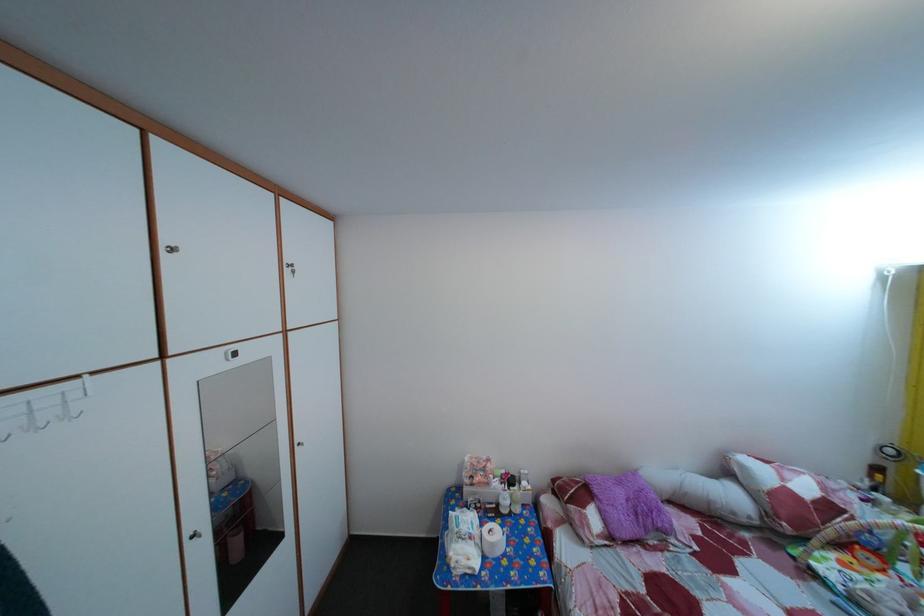
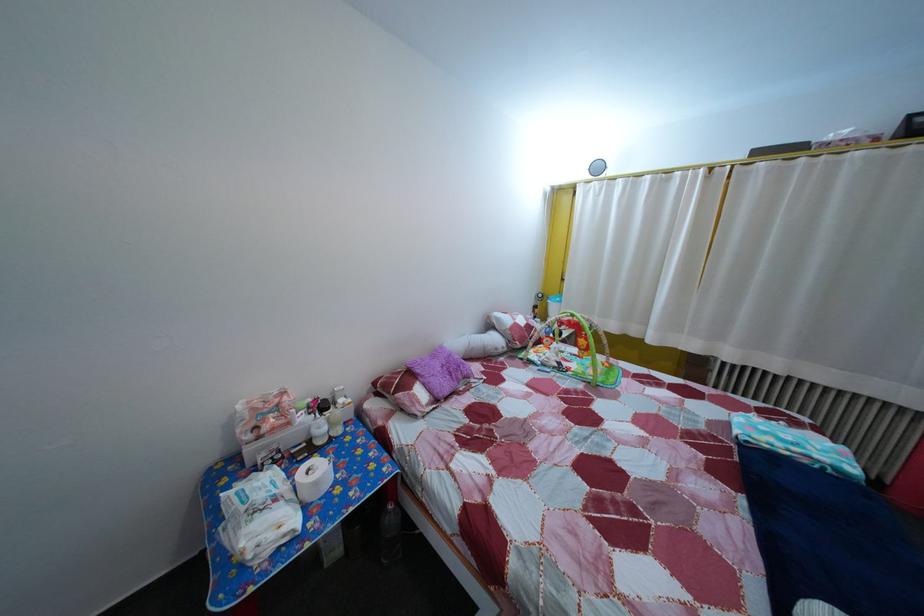
Locate, in the second image, the point that corresponds to (x=505, y=493) in the first image.

(311, 427)